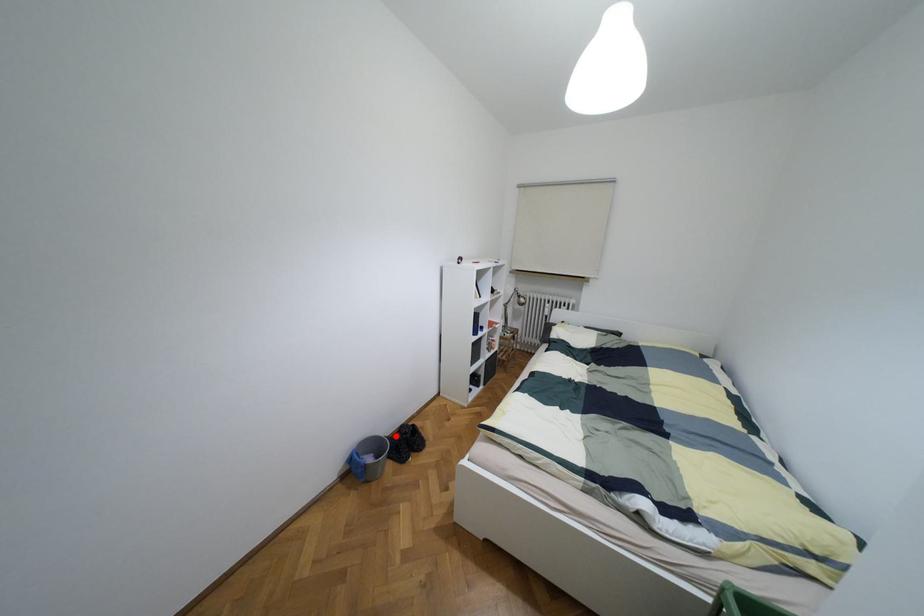
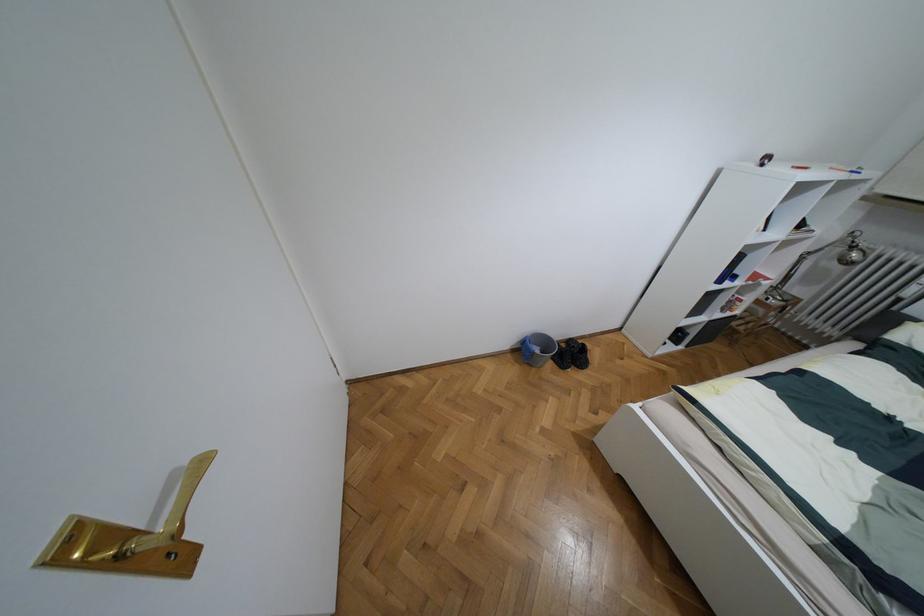
Question: I am providing you with two images of the same scene from different viewpoints. In image1, a red point is highlighted. Considering the same 3D point in image2, which of the following is correct?

Choices:
 (A) It is closer
 (B) It is farther

Answer: (B)